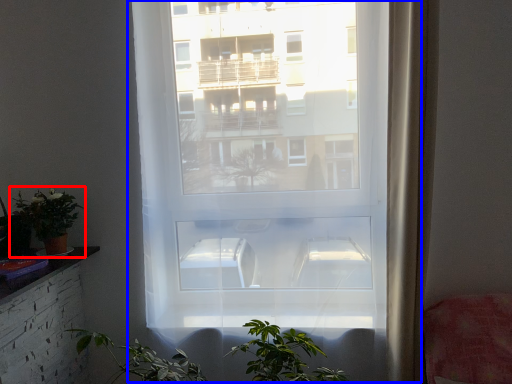
Question: Which point is closer to the camera, houseplant (highlighted by a red box) or window (highlighted by a blue box)?

Choices:
 (A) houseplant
 (B) window

Answer: (B)